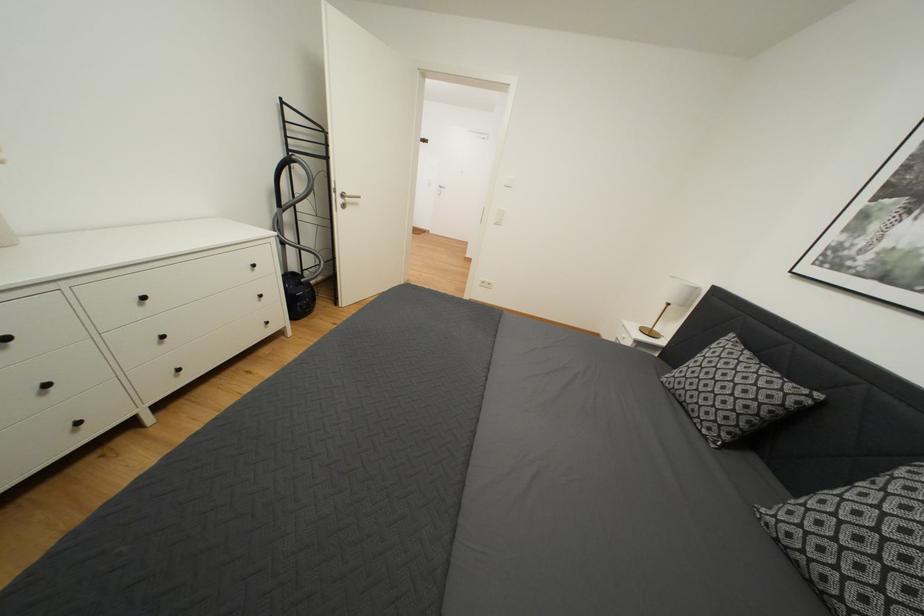
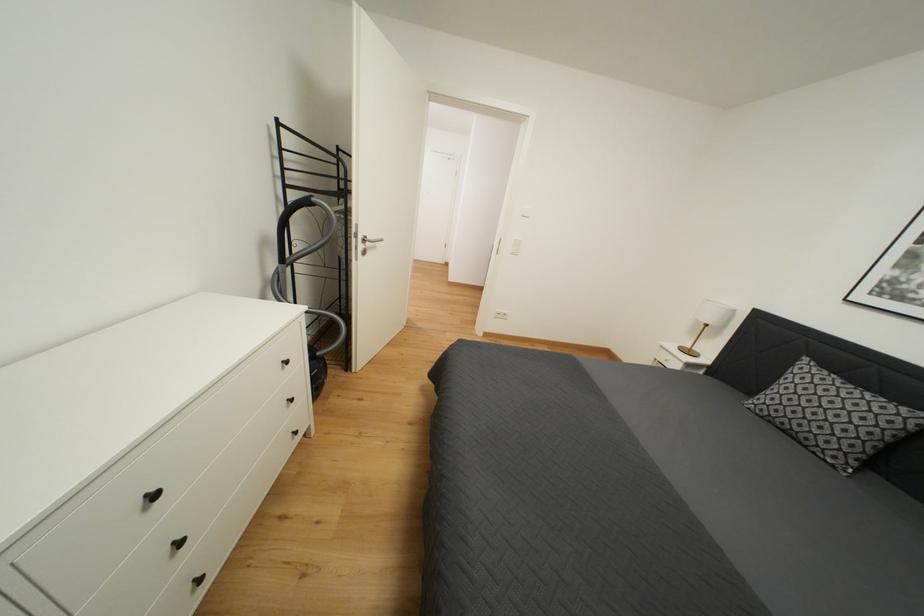
Question: The camera is either moving clockwise (left) or counter-clockwise (right) around the object. The first image is from the beginning of the video and the second image is from the end. Is the camera moving left or right when shooting the video?

Choices:
 (A) Left
 (B) Right

Answer: (A)